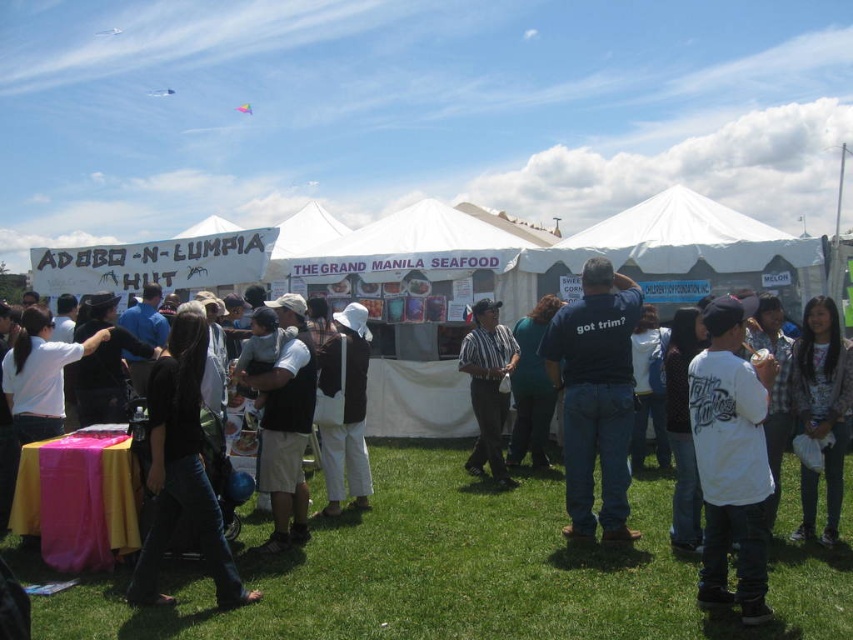
You are standing at point (276,416) and want to walk to the entrance of the event. The entrance is located behind the table with the yellow and pink tablecloth. Which direction should you go relative to point (726,582) to reach the entrance?

Since point (726,582) is in front of point (276,416), you should go behind point (726,582) to reach the entrance located behind the table with the yellow and pink tablecloth.

You are at a Filipino food festival and see a person wearing a black cotton shirt at center and a white cotton hat at center. From the perspective of someone facing the same direction as the person, which item is on the right side?

The white cotton hat at center is on the right side because the black cotton shirt at center is to the left of it.